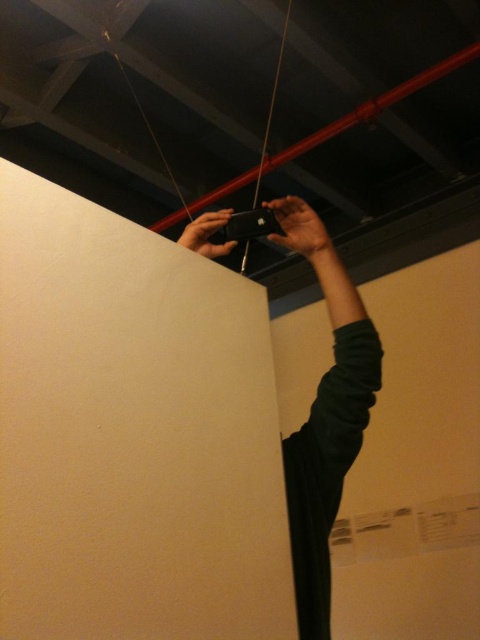
Is black matte phone at upper center smaller than dark green fabric at upper center?

Actually, black matte phone at upper center might be larger than dark green fabric at upper center.

Does black matte phone at upper center appear on the right side of dark green fabric at upper center?

Yes, black matte phone at upper center is to the right of dark green fabric at upper center.

Between point (352, 339) and point (283, 202), which one is positioned behind?

The point (283, 202) is more distant.

Identify the location of black matte phone at upper center. The width and height of the screenshot is (480, 640). (328, 445).

Who is taller, dark green fabric at upper center or black matte string at center?

With more height is black matte string at center.

Which of these two, dark green fabric at upper center or black matte string at center, stands shorter?

dark green fabric at upper center is shorter.

Is point (312, 243) positioned behind point (261, 154)?

No, (312, 243) is in front of (261, 154).

You are a GUI agent. You are given a task and a screenshot of the screen. Output one action in this format:
    pyautogui.click(x=<x>, y=<y>)
    Task: Click on the dark green fabric at upper center
    The width and height of the screenshot is (480, 640).
    Given the screenshot: What is the action you would take?
    pyautogui.click(x=300, y=230)

Based on the photo, does black matte phone at upper center appear over black matte string at center?

Actually, black matte phone at upper center is below black matte string at center.

Can you confirm if black matte phone at upper center is positioned to the left of black matte string at center?

No, black matte phone at upper center is not to the left of black matte string at center.

This screenshot has width=480, height=640. Describe the element at coordinates (328, 445) in the screenshot. I see `black matte phone at upper center` at that location.

Locate an element on the screen. This screenshot has width=480, height=640. black matte phone at upper center is located at coordinates (328, 445).